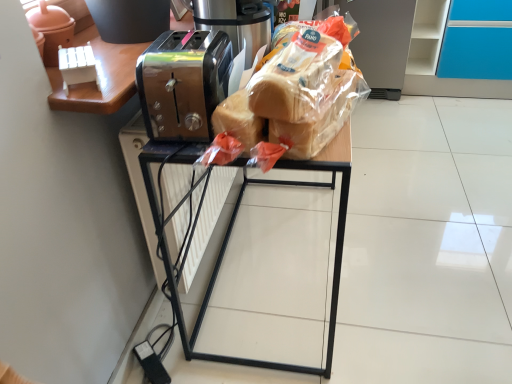
What is the approximate height of translucent plastic bread at center, arranged as the second bread when ordered from the bottom?

The height of translucent plastic bread at center, arranged as the second bread when ordered from the bottom, is 4.81 inches.

Locate an element on the screen. The image size is (512, 384). translucent plastic bread at center is located at coordinates (379, 41).

Which is more to the left, metallic toaster at center or translucent plastic bread at center?

metallic toaster at center.

From a real-world perspective, who is located higher, metallic toaster at center or translucent plastic bread at center?

metallic toaster at center is physically above.

Would you say metallic toaster at center is inside or outside translucent plastic bread at center?

The correct answer is: outside.

Between metallic toaster at center and translucent plastic bread at center, which one is positioned in front?

metallic toaster at center is closer to the camera.

Considering the sizes of objects translucent plastic bread at center, arranged as the second bread when ordered from the bottom, and metallic toaster at center in the image provided, who is shorter, translucent plastic bread at center, arranged as the second bread when ordered from the bottom, or metallic toaster at center?

translucent plastic bread at center, arranged as the second bread when ordered from the bottom.

From the metallic toaster at center, count 2nd breads forward and point to it. Please provide its 2D coordinates.

[(297, 75)]

Is the depth of translucent plastic bread at center, the first bread positioned from the top, greater than that of metallic toaster at center?

No, it is not.

Which of these two, translucent plastic bread at center, the first bread positioned from the top, or metallic toaster at center, is wider?

Wider between the two is metallic toaster at center.

Which object is thinner, translucent plastic bread at center or translucent plastic bread at center, the 1th bread from the bottom?

Thinner between the two is translucent plastic bread at center, the 1th bread from the bottom.

In the scene shown: Do you think translucent plastic bread at center is within translucent plastic bread at center, the 1th bread from the bottom, or outside of it?

translucent plastic bread at center cannot be found inside translucent plastic bread at center, the 1th bread from the bottom.

From the image's perspective, which one is positioned lower, translucent plastic bread at center or translucent plastic bread at center, which is the second bread in top-to-bottom order?

translucent plastic bread at center, which is the second bread in top-to-bottom order, appears lower in the image.

Measure the distance from translucent plastic bread at center to metallic toaster at center.

The distance of translucent plastic bread at center from metallic toaster at center is 4.33 feet.

How different are the orientations of translucent plastic bread at center and metallic toaster at center in degrees?

The angular difference between translucent plastic bread at center and metallic toaster at center is 91.6 degrees.

Considering the relative sizes of translucent plastic bread at center and metallic toaster at center in the image provided, is translucent plastic bread at center shorter than metallic toaster at center?

Indeed, translucent plastic bread at center has a lesser height compared to metallic toaster at center.

Is translucent plastic bread at center wider than metallic toaster at center?

Correct, the width of translucent plastic bread at center exceeds that of metallic toaster at center.

Does point (276, 129) lie behind point (401, 8)?

No, it is in front of (401, 8).

Is the position of translucent plastic bread at center, the 1th bread from the bottom, more distant than that of translucent plastic bread at center?

No, the depth of translucent plastic bread at center, the 1th bread from the bottom, is less than that of translucent plastic bread at center.

Looking at this image, would you say translucent plastic bread at center is part of translucent plastic bread at center, the 1th bread from the bottom,'s contents?

No, translucent plastic bread at center is located outside of translucent plastic bread at center, the 1th bread from the bottom.

From the image's perspective, relative to translucent plastic bread at center, is translucent plastic bread at center, which is the second bread in top-to-bottom order, above or below?

translucent plastic bread at center, which is the second bread in top-to-bottom order, is situated lower than translucent plastic bread at center in the image.

In the scene shown: Based on their sizes in the image, would you say translucent plastic bread at center, arranged as the second bread when ordered from the bottom, is bigger or smaller than translucent plastic bread at center?

In the image, translucent plastic bread at center, arranged as the second bread when ordered from the bottom, appears to be smaller than translucent plastic bread at center.

Considering their positions, is translucent plastic bread at center, the first bread positioned from the top, located in front of or behind translucent plastic bread at center?

translucent plastic bread at center, the first bread positioned from the top, is positioned closer to the viewer than translucent plastic bread at center.

Is translucent plastic bread at center, the first bread positioned from the top, far from translucent plastic bread at center?

That's right, there is a large distance between translucent plastic bread at center, the first bread positioned from the top, and translucent plastic bread at center.

Is translucent plastic bread at center at the back of translucent plastic bread at center, the first bread positioned from the top?

No, translucent plastic bread at center, the first bread positioned from the top, is not facing away from translucent plastic bread at center.

Which is behind, point (338, 44) or point (361, 91)?

Positioned behind is point (361, 91).

Where is `bread in front of the translucent plastic bread at center, the 1th bread from the bottom`? The image size is (512, 384). bread in front of the translucent plastic bread at center, the 1th bread from the bottom is located at coordinates (297, 75).

Considering the relative sizes of translucent plastic bread at center, the first bread positioned from the top, and translucent plastic bread at center, which is the second bread in top-to-bottom order, in the image provided, is translucent plastic bread at center, the first bread positioned from the top, thinner than translucent plastic bread at center, which is the second bread in top-to-bottom order,?

No.

Which is behind, translucent plastic bread at center, the first bread positioned from the top, or translucent plastic bread at center, which is the second bread in top-to-bottom order?

translucent plastic bread at center, which is the second bread in top-to-bottom order, is further from the camera.

Find the location of a particular element. This screenshot has width=512, height=384. furniture in front of the translucent plastic bread at center is located at coordinates (231, 231).

Locate an element on the screen. This screenshot has width=512, height=384. the 2nd bread above the metallic toaster at center (from the image's perspective) is located at coordinates (297, 75).

When comparing their distances from metallic toaster at center, does translucent plastic bread at center, the first bread positioned from the top, or translucent plastic bread at center seem further?

translucent plastic bread at center is positioned further to the anchor metallic toaster at center.

Considering their positions, is translucent plastic bread at center positioned further to translucent plastic bread at center, the first bread positioned from the top, than metallic toaster at center?

The object further to translucent plastic bread at center, the first bread positioned from the top, is translucent plastic bread at center.

When comparing their distances from translucent plastic bread at center, the first bread positioned from the top, does translucent plastic bread at center or translucent plastic bread at center, which is the second bread in top-to-bottom order, seem further?

translucent plastic bread at center lies further to translucent plastic bread at center, the first bread positioned from the top, than the other object.

Looking at the image, which one is located further to translucent plastic bread at center, the 1th bread from the bottom, metallic toaster at center or translucent plastic bread at center, the first bread positioned from the top?

metallic toaster at center.

Estimate the real-world distances between objects in this image. Which object is closer to translucent plastic bread at center, metallic toaster at center or translucent plastic bread at center, arranged as the second bread when ordered from the bottom?

The object closer to translucent plastic bread at center is metallic toaster at center.

Which object lies further to the anchor point translucent plastic bread at center, which is the second bread in top-to-bottom order, translucent plastic bread at center or translucent plastic bread at center, arranged as the second bread when ordered from the bottom?

translucent plastic bread at center.

Which object lies further to the anchor point translucent plastic bread at center, metallic toaster at center or translucent plastic bread at center, which is the second bread in top-to-bottom order?

The object further to translucent plastic bread at center is translucent plastic bread at center, which is the second bread in top-to-bottom order.

When comparing their distances from metallic toaster at center, does translucent plastic bread at center, which is the second bread in top-to-bottom order, or translucent plastic bread at center, the first bread positioned from the top, seem further?

translucent plastic bread at center, which is the second bread in top-to-bottom order, lies further to metallic toaster at center than the other object.

Where is `bread between translucent plastic bread at center, arranged as the second bread when ordered from the bottom, and metallic toaster at center, in the vertical direction`? This screenshot has height=384, width=512. bread between translucent plastic bread at center, arranged as the second bread when ordered from the bottom, and metallic toaster at center, in the vertical direction is located at coordinates (321, 118).

Image resolution: width=512 pixels, height=384 pixels. Find the location of `furniture between translucent plastic bread at center, the first bread positioned from the top, and translucent plastic bread at center from front to back`. furniture between translucent plastic bread at center, the first bread positioned from the top, and translucent plastic bread at center from front to back is located at coordinates (231, 231).

The height and width of the screenshot is (384, 512). I want to click on furniture between translucent plastic bread at center, which is the second bread in top-to-bottom order, and translucent plastic bread at center in the front-back direction, so click(231, 231).

In order to click on bread between translucent plastic bread at center, arranged as the second bread when ordered from the bottom, and translucent plastic bread at center from front to back in this screenshot , I will do `click(321, 118)`.